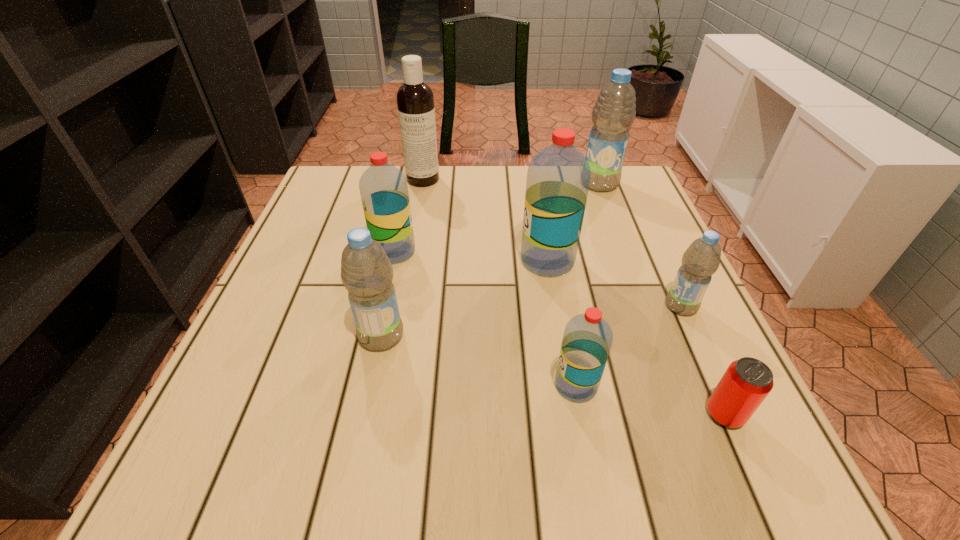
Where is `dishwasher detergent`? dishwasher detergent is located at coordinates (415, 101).

Image resolution: width=960 pixels, height=540 pixels. What are the coordinates of `the farthest blue water bottle` in the screenshot? It's located at (614, 112).

The width and height of the screenshot is (960, 540). I want to click on the biggest blue water bottle, so click(614, 112).

Find the location of `the biggest red water bottle`. the biggest red water bottle is located at coordinates (558, 177).

Identify the location of the third nearest object. The width and height of the screenshot is (960, 540). (366, 272).

The height and width of the screenshot is (540, 960). I want to click on the fifth farthest water bottle, so click(x=366, y=272).

You are a GUI agent. You are given a task and a screenshot of the screen. Output one action in this format:
    pyautogui.click(x=<x>, y=<y>)
    Task: Click on the leftmost red water bottle
    
    Given the screenshot: What is the action you would take?
    pyautogui.click(x=383, y=188)

You are a GUI agent. You are given a task and a screenshot of the screen. Output one action in this format:
    pyautogui.click(x=<x>, y=<y>)
    Task: Click on the smallest blue water bottle
    The width and height of the screenshot is (960, 540).
    Given the screenshot: What is the action you would take?
    pyautogui.click(x=700, y=261)

You are a GUI agent. You are given a task and a screenshot of the screen. Output one action in this format:
    pyautogui.click(x=<x>, y=<y>)
    Task: Click on the third nearest water bottle
    
    Given the screenshot: What is the action you would take?
    pyautogui.click(x=700, y=261)

In order to click on the nearest water bottle in this screenshot , I will do `click(587, 339)`.